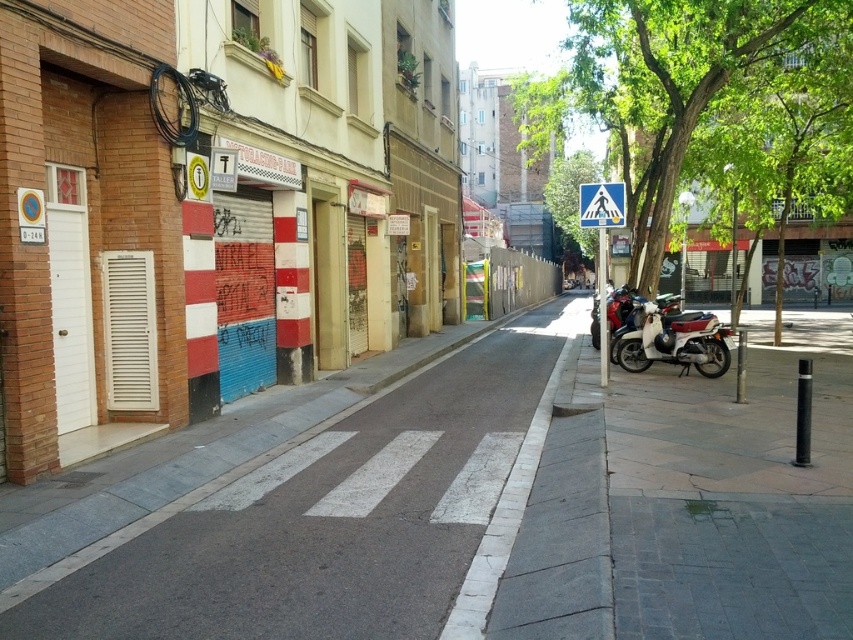
Question: Is green leafy tree at upper right to the right of blue plastic pedestrian crossing sign at center from the viewer's perspective?

Choices:
 (A) no
 (B) yes

Answer: (B)

Question: Which object appears closest to the camera in this image?

Choices:
 (A) metallic blue scooter at right
 (B) blue plastic pedestrian crossing sign at center

Answer: (B)

Question: Which of the following is the farthest from the observer?

Choices:
 (A) metallic blue scooter at right
 (B) green leafy tree at upper right
 (C) gray concrete pavement at center

Answer: (B)

Question: Which object is closer to the camera taking this photo?

Choices:
 (A) gray concrete pavement at center
 (B) blue plastic pedestrian crossing sign at center
 (C) metallic blue scooter at right

Answer: (A)

Question: Can you confirm if metallic blue scooter at right is smaller than blue plastic pedestrian crossing sign at center?

Choices:
 (A) yes
 (B) no

Answer: (A)

Question: Can you confirm if metallic blue scooter at right is positioned above blue plastic pedestrian crossing sign at center?

Choices:
 (A) no
 (B) yes

Answer: (A)